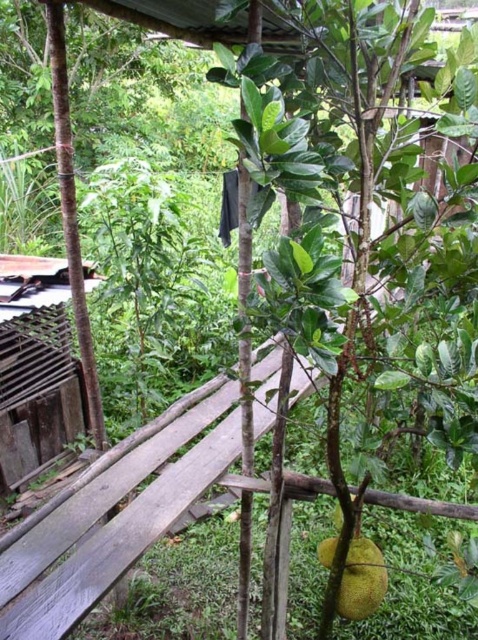
Question: Among these points, which one is nearest to the camera?

Choices:
 (A) (359, 561)
 (B) (88, 509)

Answer: (A)

Question: Which point appears farthest from the camera in this image?

Choices:
 (A) (147, 461)
 (B) (372, 605)

Answer: (A)

Question: From the image, what is the correct spatial relationship of weathered wood bench at center in relation to yellow matte jackfruit at center?

Choices:
 (A) right
 (B) left

Answer: (B)

Question: Observing the image, what is the correct spatial positioning of weathered wood bench at center in reference to yellow matte jackfruit at center?

Choices:
 (A) right
 (B) left

Answer: (B)

Question: Does weathered wood bench at center appear under yellow matte jackfruit at center?

Choices:
 (A) no
 (B) yes

Answer: (A)